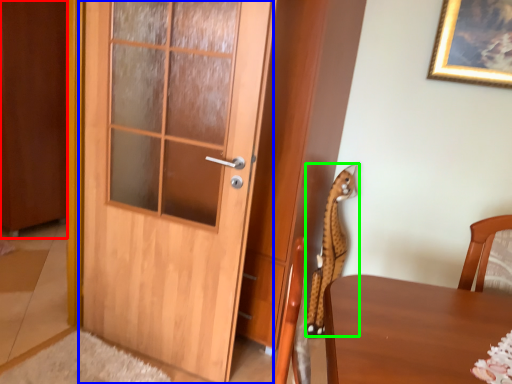
Question: Which object is the closest to the barn door (highlighted by a red box)? Choose among these: door (highlighted by a blue box) or animal (highlighted by a green box).

Choices:
 (A) door
 (B) animal

Answer: (A)